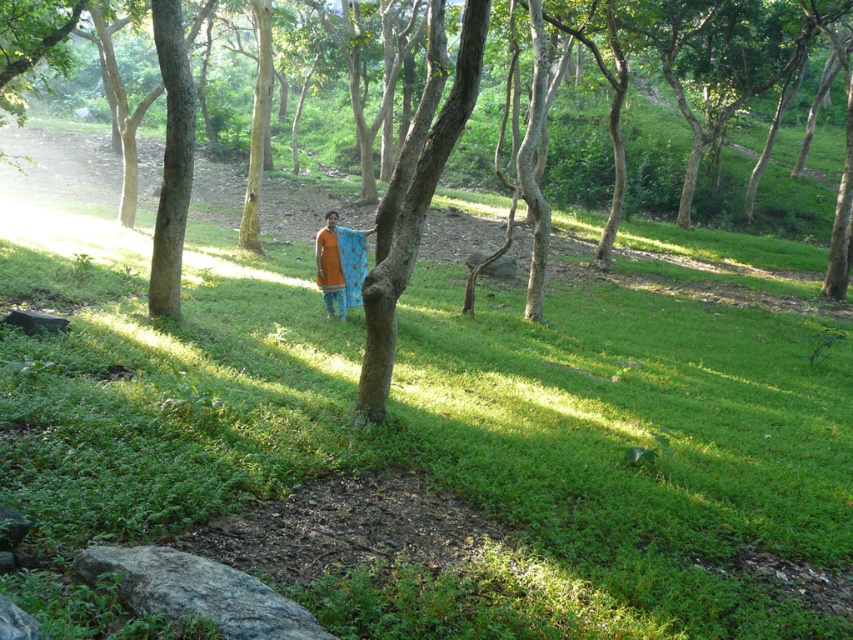
Question: Is rough bark tree at center below orange fabric at center?

Choices:
 (A) no
 (B) yes

Answer: (B)

Question: Among these objects, which one is nearest to the camera?

Choices:
 (A) orange fabric at center
 (B) rough bark tree at center

Answer: (B)

Question: Can you confirm if green grassy at center is positioned above orange fabric at center?

Choices:
 (A) no
 (B) yes

Answer: (A)

Question: Which point is closer to the camera?

Choices:
 (A) (329, 236)
 (B) (392, 289)

Answer: (B)

Question: Where is rough bark tree at center located in relation to orange fabric at center in the image?

Choices:
 (A) left
 (B) right

Answer: (B)

Question: Among these points, which one is farthest from the camera?

Choices:
 (A) [184, 438]
 (B) [451, 136]

Answer: (B)